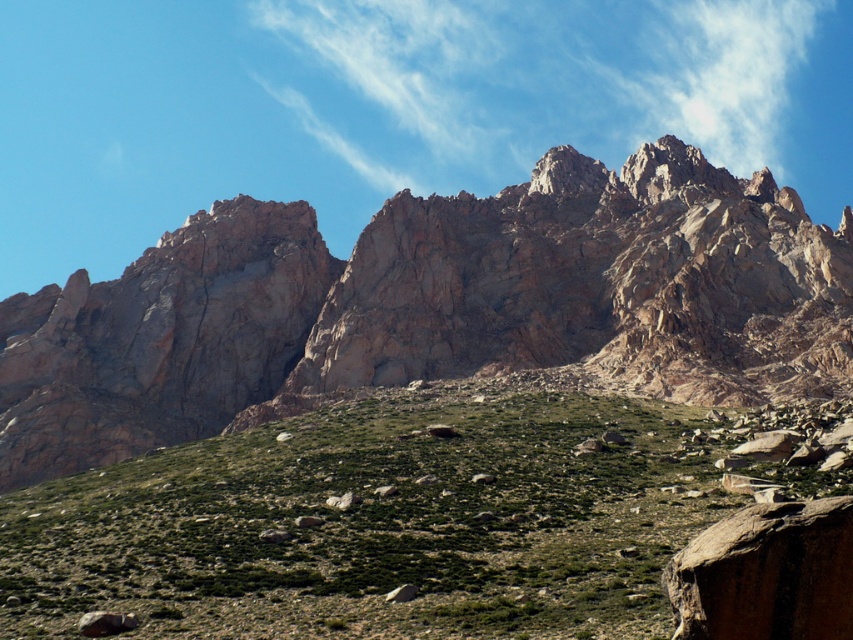
Is rugged rock mountain range at upper center shorter than green grassy hillside at lower center?

Incorrect, rugged rock mountain range at upper center's height does not fall short of green grassy hillside at lower center's.

Is rugged rock mountain range at upper center positioned behind green grassy hillside at lower center?

Yes, it is.

What are the coordinates of `rugged rock mountain range at upper center` in the screenshot? It's located at (433, 305).

You are a GUI agent. You are given a task and a screenshot of the screen. Output one action in this format:
    pyautogui.click(x=<x>, y=<y>)
    Task: Click on the rugged rock mountain range at upper center
    
    Given the screenshot: What is the action you would take?
    pyautogui.click(x=433, y=305)